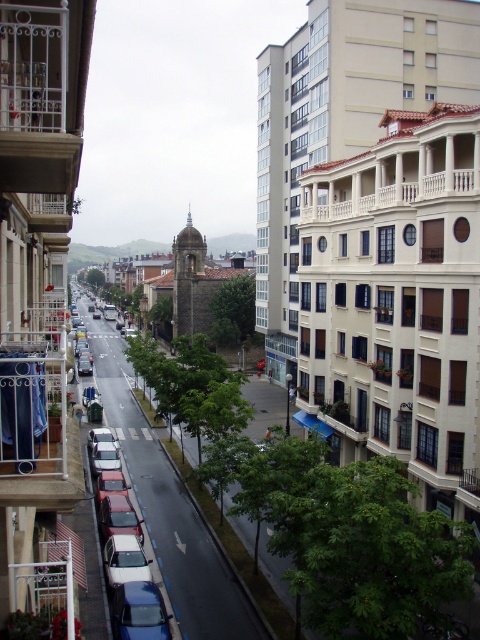
You are standing on a balcony overlooking the street and want to hang a large potted plant. The potted plant requires a space that is wider than the metallic blue sedan at lower left. Is the white metal balcony at left suitable for this?

The white metal balcony at left might be wider than the metallic blue sedan at lower left, so it could be suitable for the large potted plant if the balcony is indeed wider.

You are standing on a balcony overlooking the street and want to take a photo of the white metal balcony at left. If your camera has a maximum focus range of 30 feet, will you be able to capture it clearly?

The white metal balcony at left is 31.28 feet away from the camera, which exceeds the maximum focus range of 30 feet. Therefore, you won